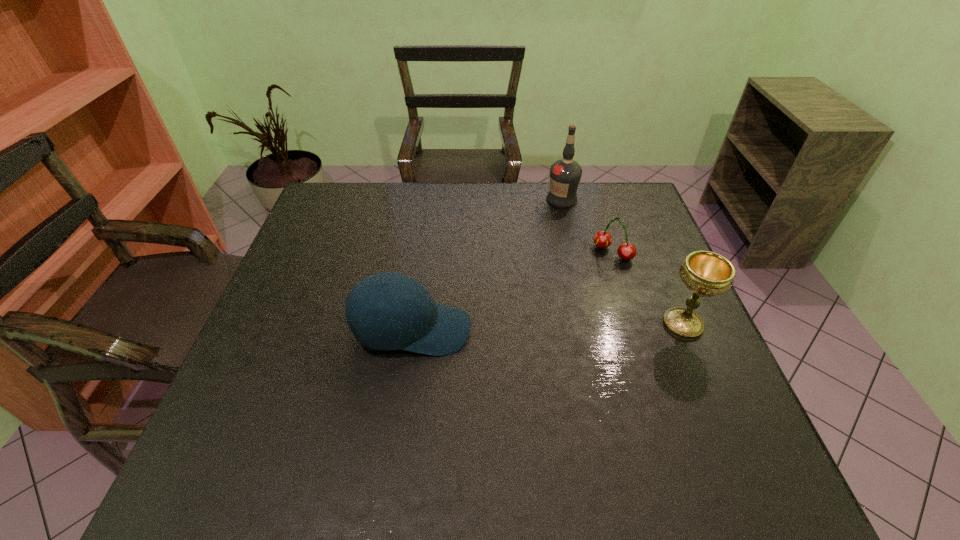
The height and width of the screenshot is (540, 960). What are the coordinates of `vacant space located 0.290m with stems pointing upwards on the cherry` in the screenshot? It's located at (538, 319).

At what (x,y) coordinates should I click in order to perform the action: click on vacant region located with stems pointing upwards on the cherry. Please return your answer as a coordinate pair (x, y). Looking at the image, I should click on (555, 303).

Image resolution: width=960 pixels, height=540 pixels. Find the location of `free location located 0.070m with stems pointing upwards on the cherry`. free location located 0.070m with stems pointing upwards on the cherry is located at coordinates (588, 274).

At what (x,y) coordinates should I click in order to perform the action: click on vacant region located 0.370m on the front label of the farthest object. Please return your answer as a coordinate pair (x, y). The height and width of the screenshot is (540, 960). Looking at the image, I should click on (535, 287).

Find the location of `vacant space located 0.400m on the front label of the farthest object`. vacant space located 0.400m on the front label of the farthest object is located at coordinates (533, 295).

Locate an element on the screen. This screenshot has width=960, height=540. free space located 0.380m on the front label of the farthest object is located at coordinates (534, 289).

At what (x,y) coordinates should I click in order to perform the action: click on object that is at the far edge. Please return your answer as a coordinate pair (x, y). This screenshot has height=540, width=960. Looking at the image, I should click on (565, 174).

Where is `chalice that is at the right edge`? chalice that is at the right edge is located at coordinates (705, 273).

This screenshot has height=540, width=960. I want to click on cherry present at the right edge, so click(x=626, y=251).

Where is `free space at the far edge`? This screenshot has height=540, width=960. free space at the far edge is located at coordinates (555, 211).